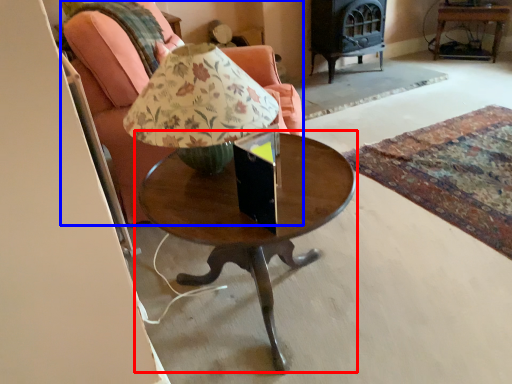
Question: Which object appears farthest to the camera in this image, coffee table (highlighted by a red box) or chair (highlighted by a blue box)?

Choices:
 (A) coffee table
 (B) chair

Answer: (B)